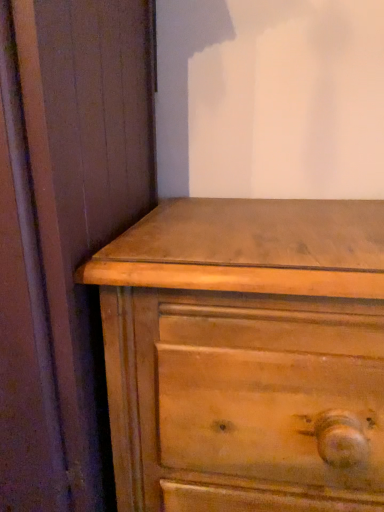
Question: From the image's perspective, does matte wood dresser at lower right appear lower than light brown wood chest of drawers at center?

Choices:
 (A) no
 (B) yes

Answer: (A)

Question: Can you confirm if matte wood dresser at lower right is taller than light brown wood chest of drawers at center?

Choices:
 (A) no
 (B) yes

Answer: (B)

Question: From a real-world perspective, is matte wood dresser at lower right over light brown wood chest of drawers at center?

Choices:
 (A) no
 (B) yes

Answer: (B)

Question: From a real-world perspective, is matte wood dresser at lower right located beneath light brown wood chest of drawers at center?

Choices:
 (A) yes
 (B) no

Answer: (B)

Question: Could you tell me if matte wood dresser at lower right is turned towards light brown wood chest of drawers at center?

Choices:
 (A) no
 (B) yes

Answer: (A)

Question: Is matte wood dresser at lower right thinner than light brown wood chest of drawers at center?

Choices:
 (A) yes
 (B) no

Answer: (B)

Question: From a real-world perspective, is light brown wood chest of drawers at center on matte wood dresser at lower right?

Choices:
 (A) yes
 (B) no

Answer: (B)

Question: Would you consider light brown wood chest of drawers at center to be distant from matte wood dresser at lower right?

Choices:
 (A) yes
 (B) no

Answer: (B)

Question: Can you confirm if light brown wood chest of drawers at center is positioned to the left of matte wood dresser at lower right?

Choices:
 (A) yes
 (B) no

Answer: (B)

Question: Can you confirm if light brown wood chest of drawers at center is wider than matte wood dresser at lower right?

Choices:
 (A) yes
 (B) no

Answer: (B)

Question: Can you confirm if light brown wood chest of drawers at center is positioned to the right of matte wood dresser at lower right?

Choices:
 (A) no
 (B) yes

Answer: (B)

Question: Can matte wood dresser at lower right be found inside light brown wood chest of drawers at center?

Choices:
 (A) yes
 (B) no

Answer: (B)

Question: From a real-world perspective, is light brown wood chest of drawers at center above or below matte wood dresser at lower right?

Choices:
 (A) below
 (B) above

Answer: (A)